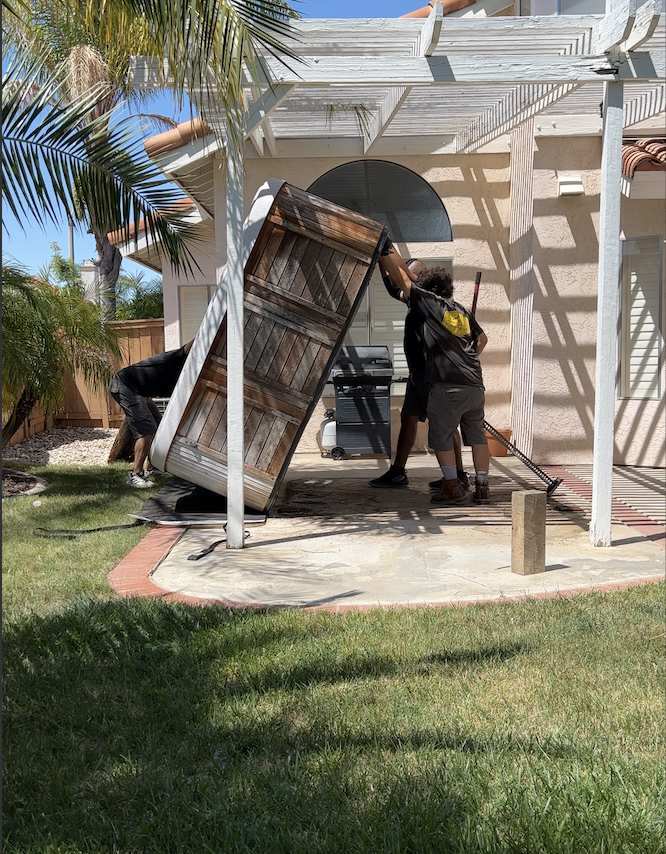
Locate an element on the screen. The image size is (666, 854). door is located at coordinates (264, 314).